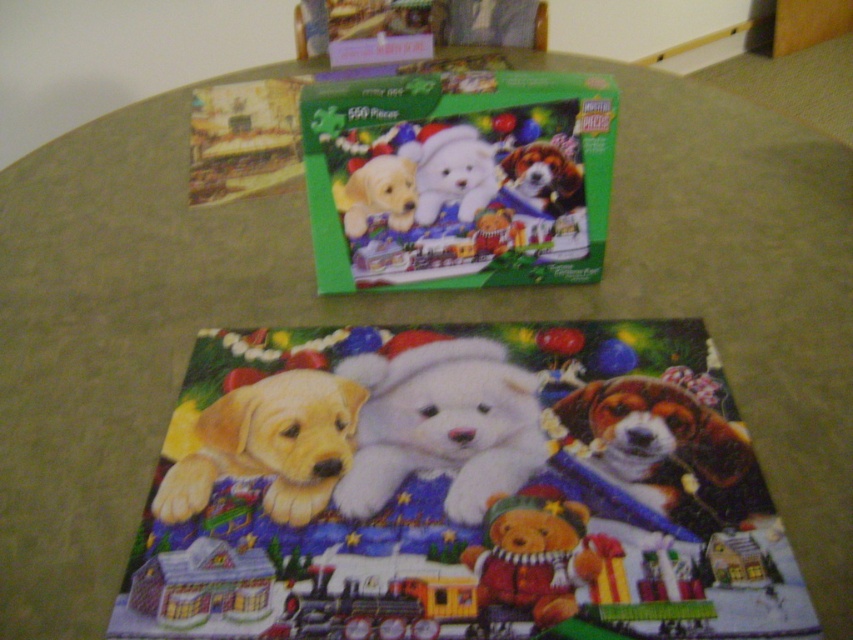
Is golden fur puppy at center positioned behind white plush teddy bear at upper center?

No, it is not.

Does point (317, 444) come in front of point (451, 168)?

Yes, it is.

Between point (253, 452) and point (459, 157), which one is positioned behind?

Positioned behind is point (459, 157).

The height and width of the screenshot is (640, 853). I want to click on golden fur puppy at center, so click(270, 445).

Does golden fur puppy at center appear under velvety brown teddy bear at lower right?

Actually, golden fur puppy at center is above velvety brown teddy bear at lower right.

This screenshot has height=640, width=853. I want to click on golden fur puppy at center, so click(270, 445).

Identify the location of golden fur puppy at center. The image size is (853, 640). (270, 445).

Identify the location of golden fur puppy at center. This screenshot has height=640, width=853. (270, 445).

Is white plush teddy bear at center positioned in front of velvety brown teddy bear at lower right?

No.

Does white plush teddy bear at center appear under velvety brown teddy bear at lower right?

Actually, white plush teddy bear at center is above velvety brown teddy bear at lower right.

Find the location of a particular element. white plush teddy bear at center is located at coordinates (442, 426).